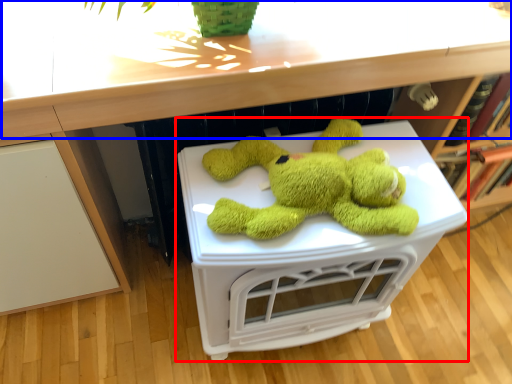
Question: Among these objects, which one is nearest to the camera, table (highlighted by a red box) or counter top (highlighted by a blue box)?

Choices:
 (A) table
 (B) counter top

Answer: (B)